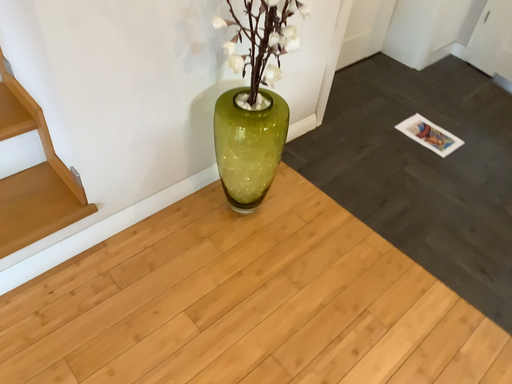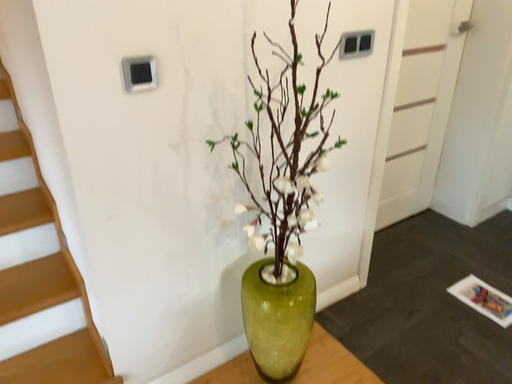
Question: Which way did the camera rotate in the video?

Choices:
 (A) rotated right
 (B) rotated left

Answer: (B)